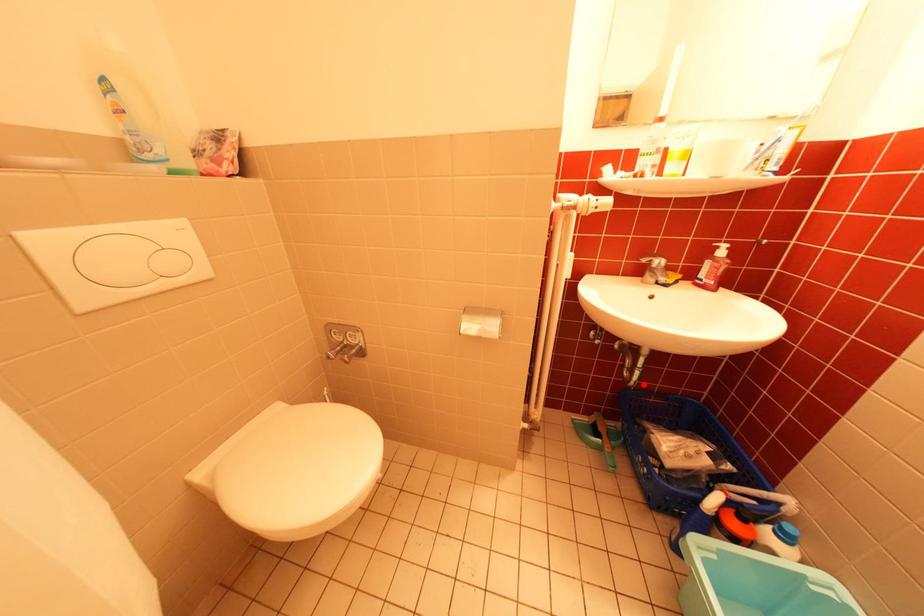
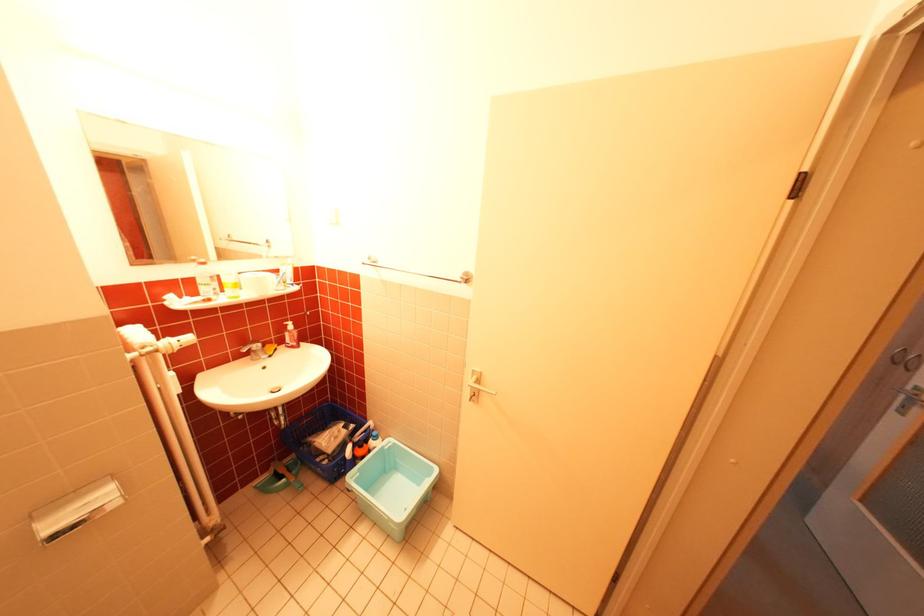
Where in the second image is the point corresponding to the highlighted location from the first image?

(295, 428)